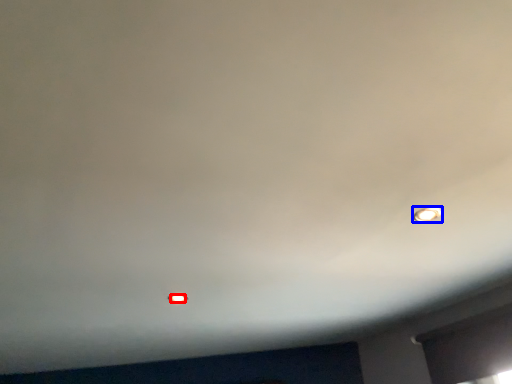
Question: Among these objects, which one is nearest to the camera, light bulb (highlighted by a red box) or light bulb (highlighted by a blue box)?

Choices:
 (A) light bulb
 (B) light bulb

Answer: (B)